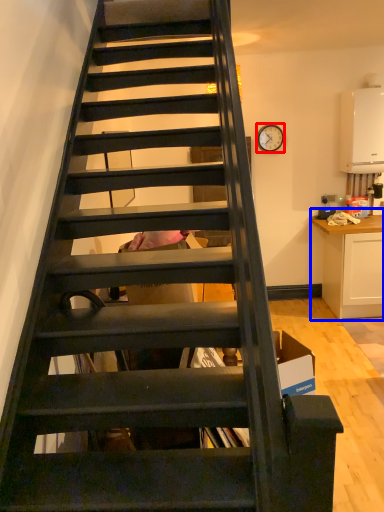
Question: Which point is closer to the camera, clock (highlighted by a red box) or cabinetry (highlighted by a blue box)?

Choices:
 (A) clock
 (B) cabinetry

Answer: (B)